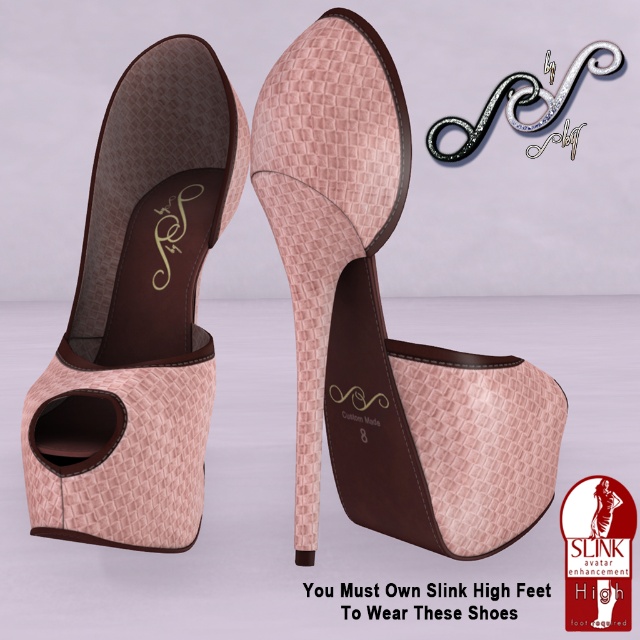
Who is higher up, pink textured high heel at center or pink textured heel at center?

pink textured high heel at center is higher up.

Measure the distance from pink textured high heel at center to pink textured heel at center.

They are 27.40 centimeters apart.

Is point (428, 392) closer to camera compared to point (310, 556)?

Yes, point (428, 392) is in front of point (310, 556).

Identify the location of pink textured high heel at center. This screenshot has width=640, height=640. (384, 321).

Can you confirm if pink textured high heel at center is taller than pink woven leather sandal at left?

Incorrect, pink textured high heel at center's height is not larger of pink woven leather sandal at left's.

Locate an element on the screen. pink textured high heel at center is located at coordinates (384, 321).

This screenshot has width=640, height=640. Find the location of `pink textured high heel at center`. pink textured high heel at center is located at coordinates (384, 321).

Find the location of `pink textured high heel at center`. pink textured high heel at center is located at coordinates (384, 321).

Which is above, pink woven leather sandal at left or pink textured heel at center?

pink woven leather sandal at left is higher up.

The image size is (640, 640). What are the coordinates of `pink woven leather sandal at left` in the screenshot? It's located at (140, 314).

This screenshot has width=640, height=640. Describe the element at coordinates (140, 314) in the screenshot. I see `pink woven leather sandal at left` at that location.

The height and width of the screenshot is (640, 640). In order to click on pink woven leather sandal at left in this screenshot , I will do (140, 314).